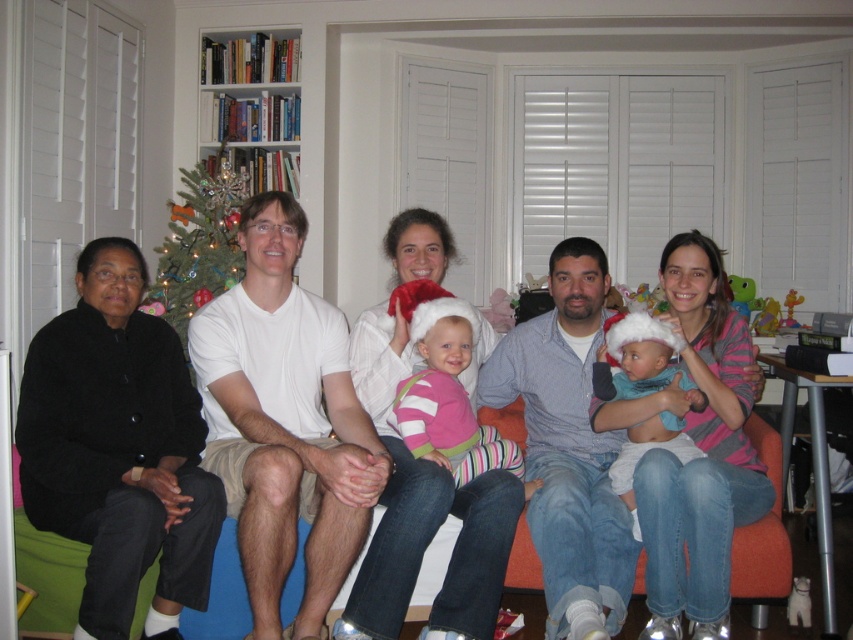
Which is in front, point (157, 497) or point (668, 440)?

Point (157, 497) is in front.

Is point (346, 468) closer to camera compared to point (606, 324)?

Yes, point (346, 468) is closer to viewer.

I want to click on black sweater at left, so click(x=119, y=458).

Between green artificial christmas tree at upper left and turquoise soft fabric baby at center, which one appears on the right side from the viewer's perspective?

Positioned to the right is turquoise soft fabric baby at center.

Measure the distance between green artificial christmas tree at upper left and camera.

green artificial christmas tree at upper left and camera are 3.33 meters apart from each other.

Where is `green artificial christmas tree at upper left`? The height and width of the screenshot is (640, 853). green artificial christmas tree at upper left is located at coordinates (199, 243).

At what (x,y) coordinates should I click in order to perform the action: click on green artificial christmas tree at upper left. Please return your answer as a coordinate pair (x, y). The height and width of the screenshot is (640, 853). Looking at the image, I should click on (199, 243).

Does pink striped sweater at center appear over turquoise soft fabric baby at center?

Yes, pink striped sweater at center is above turquoise soft fabric baby at center.

Between point (445, 454) and point (616, 476), which one is positioned in front?

Point (445, 454)

Locate an element on the screen. Image resolution: width=853 pixels, height=640 pixels. pink striped sweater at center is located at coordinates (447, 397).